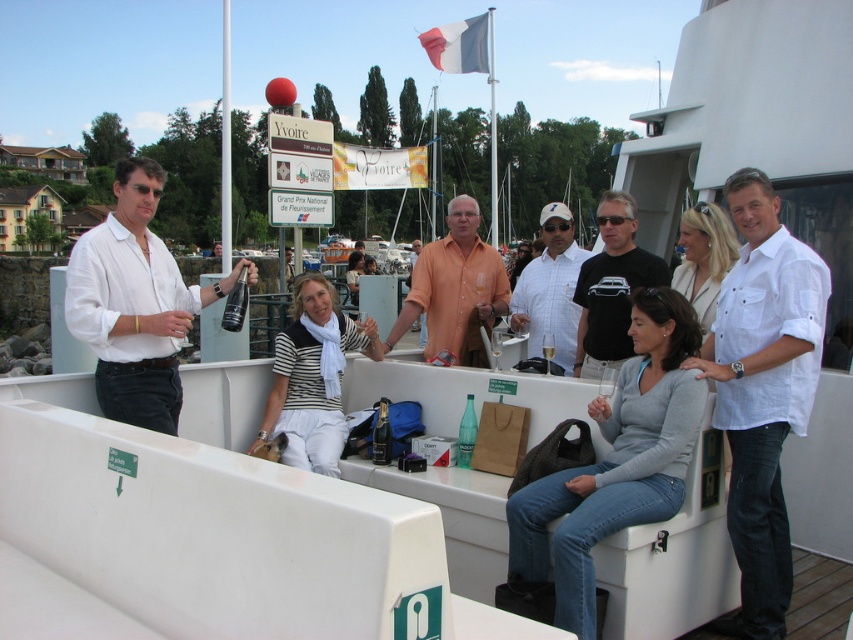
Who is lower down, white striped shirt at center or white checkered shirt at center?

white striped shirt at center

Image resolution: width=853 pixels, height=640 pixels. Describe the element at coordinates (312, 378) in the screenshot. I see `white striped shirt at center` at that location.

I want to click on white striped shirt at center, so click(312, 378).

Is gray sweater at center to the right of black t-shirt at center from the viewer's perspective?

In fact, gray sweater at center is to the left of black t-shirt at center.

Can you confirm if gray sweater at center is positioned above black t-shirt at center?

No.

Is point (625, 504) in front of point (633, 227)?

Yes.

The height and width of the screenshot is (640, 853). I want to click on gray sweater at center, so click(616, 461).

Identify the location of orange matte shirt at center. This screenshot has width=853, height=640. (453, 284).

Does orange matte shirt at center lie behind black t-shirt at center?

Yes.

Does point (480, 298) lie behind point (634, 259)?

Yes, it is behind point (634, 259).

In order to click on orange matte shirt at center in this screenshot , I will do `click(453, 284)`.